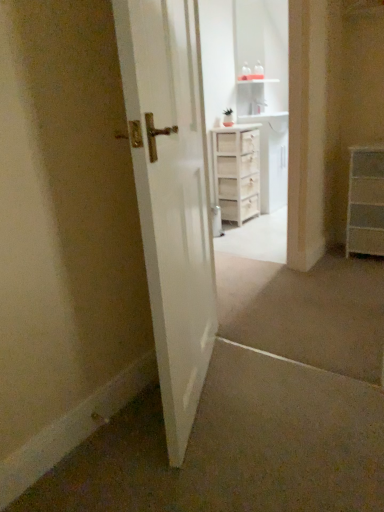
Question: Can you confirm if white wooden chest of drawers at center, acting as the second chest of drawers starting from the right, is smaller than white wood cabinet at center?

Choices:
 (A) yes
 (B) no

Answer: (A)

Question: From a real-world perspective, is white wooden chest of drawers at center, which is the first chest of drawers from back to front, physically below white wood cabinet at center?

Choices:
 (A) no
 (B) yes

Answer: (B)

Question: Is white wood cabinet at center surrounded by white wooden chest of drawers at center, which is the first chest of drawers from back to front?

Choices:
 (A) yes
 (B) no

Answer: (B)

Question: Is the depth of white wooden chest of drawers at center, acting as the second chest of drawers starting from the right, less than that of white wood cabinet at center?

Choices:
 (A) yes
 (B) no

Answer: (A)

Question: Is white wooden chest of drawers at center, acting as the second chest of drawers starting from the right, wider than white wood cabinet at center?

Choices:
 (A) no
 (B) yes

Answer: (A)

Question: From a real-world perspective, is white wood cabinet at center above or below white wooden chest of drawers at center, placed as the second chest of drawers when sorted from front to back?

Choices:
 (A) below
 (B) above

Answer: (B)

Question: Do you think white wood cabinet at center is within white wooden chest of drawers at center, which is the first chest of drawers in left-to-right order, or outside of it?

Choices:
 (A) inside
 (B) outside

Answer: (B)

Question: Is white wood cabinet at center in front of or behind white wooden chest of drawers at center, placed as the second chest of drawers when sorted from front to back, in the image?

Choices:
 (A) front
 (B) behind

Answer: (B)

Question: Is point (264, 160) closer or farther from the camera than point (238, 195)?

Choices:
 (A) closer
 (B) farther

Answer: (B)

Question: Which is correct: white wooden chest of drawers at center, acting as the second chest of drawers starting from the right, is inside white wood cabinet at center, or outside of it?

Choices:
 (A) inside
 (B) outside

Answer: (B)

Question: From the image's perspective, is white wooden chest of drawers at center, acting as the second chest of drawers starting from the right, above or below white wood cabinet at center?

Choices:
 (A) above
 (B) below

Answer: (B)

Question: Is white wooden chest of drawers at center, acting as the second chest of drawers starting from the right, bigger or smaller than white wood cabinet at center?

Choices:
 (A) big
 (B) small

Answer: (B)

Question: Considering their positions, is white wooden chest of drawers at center, placed as the second chest of drawers when sorted from front to back, located in front of or behind white wood cabinet at center?

Choices:
 (A) behind
 (B) front

Answer: (B)

Question: Is point click(x=173, y=78) closer or farther from the camera than point click(x=264, y=133)?

Choices:
 (A) farther
 (B) closer

Answer: (B)

Question: Is white glossy door at center spatially inside white wood cabinet at center, or outside of it?

Choices:
 (A) outside
 (B) inside

Answer: (A)